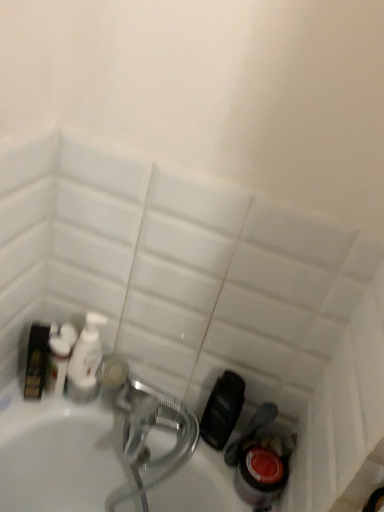
Question: From the image's perspective, relative to white glossy bottle at left, which ranks as the first cleaning product in left-to-right order, is white glossy pump bottle at center, acting as the second cleaning product starting from the left, above or below?

Choices:
 (A) above
 (B) below

Answer: (B)

Question: Relative to white glossy bottle at left, which appears as the second cleaning product when viewed from the right, is white glossy pump bottle at center, acting as the second cleaning product starting from the left, in front or behind?

Choices:
 (A) front
 (B) behind

Answer: (B)

Question: From a real-world perspective, is white glossy pump bottle at center, which appears as the first cleaning product when viewed from the right, above or below white glossy bottle at left, which ranks as the first cleaning product in left-to-right order?

Choices:
 (A) above
 (B) below

Answer: (B)

Question: Is white glossy bottle at left, which appears as the second cleaning product when viewed from the right, to the left or to the right of white glossy pump bottle at center, acting as the second cleaning product starting from the left, in the image?

Choices:
 (A) left
 (B) right

Answer: (A)

Question: From the image's perspective, is white glossy bottle at left, which ranks as the first cleaning product in left-to-right order, located above or below white glossy pump bottle at center, acting as the second cleaning product starting from the left?

Choices:
 (A) below
 (B) above

Answer: (B)

Question: Considering the positions of white glossy bottle at left, which appears as the second cleaning product when viewed from the right, and white glossy pump bottle at center, acting as the second cleaning product starting from the left, in the image, is white glossy bottle at left, which appears as the second cleaning product when viewed from the right, taller or shorter than white glossy pump bottle at center, acting as the second cleaning product starting from the left,?

Choices:
 (A) tall
 (B) short

Answer: (B)

Question: Is white glossy bottle at left, which appears as the second cleaning product when viewed from the right, situated inside white glossy pump bottle at center, acting as the second cleaning product starting from the left, or outside?

Choices:
 (A) outside
 (B) inside

Answer: (A)